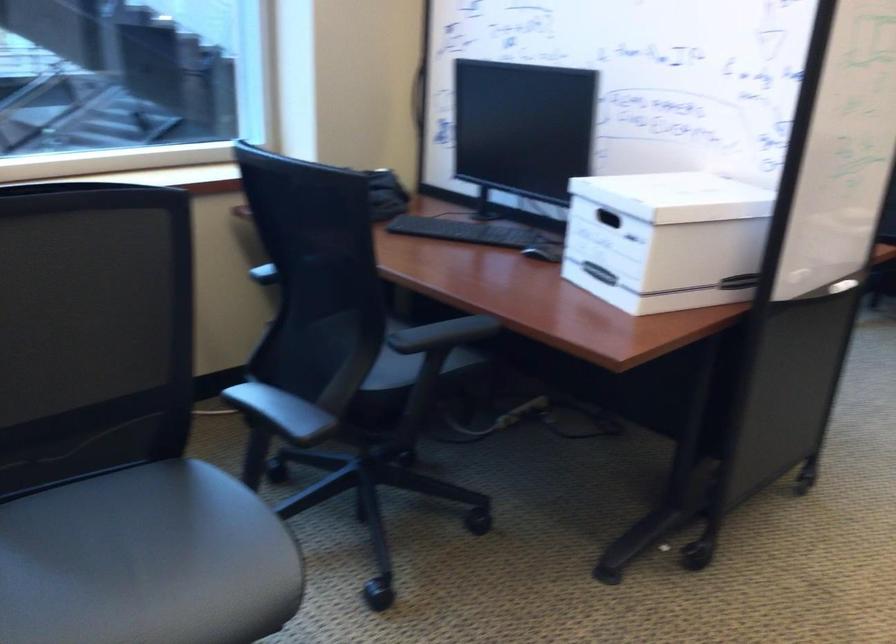
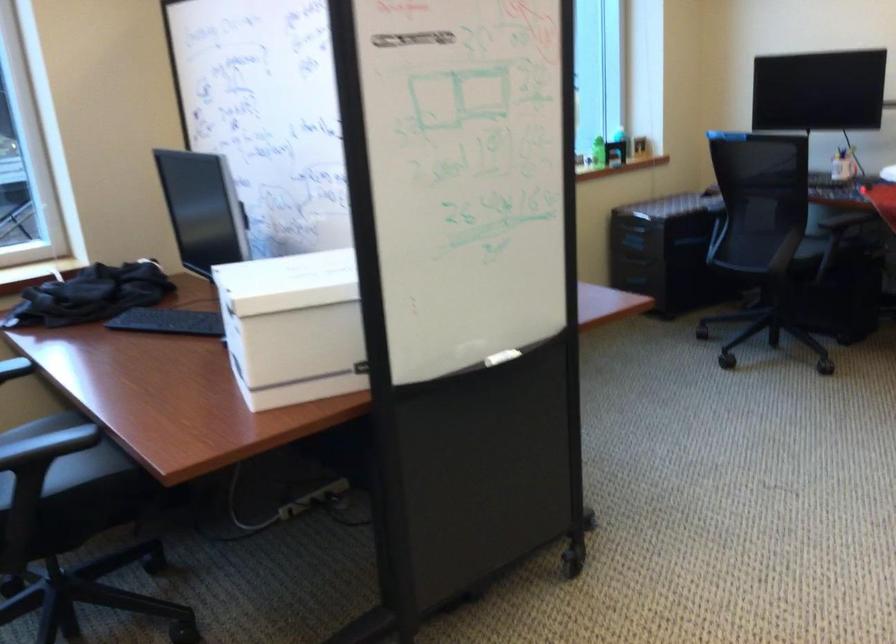
Question: What movement of the cameraman would produce the second image?

Choices:
 (A) Left
 (B) Right
 (C) Forward
 (D) Backward

Answer: (B)